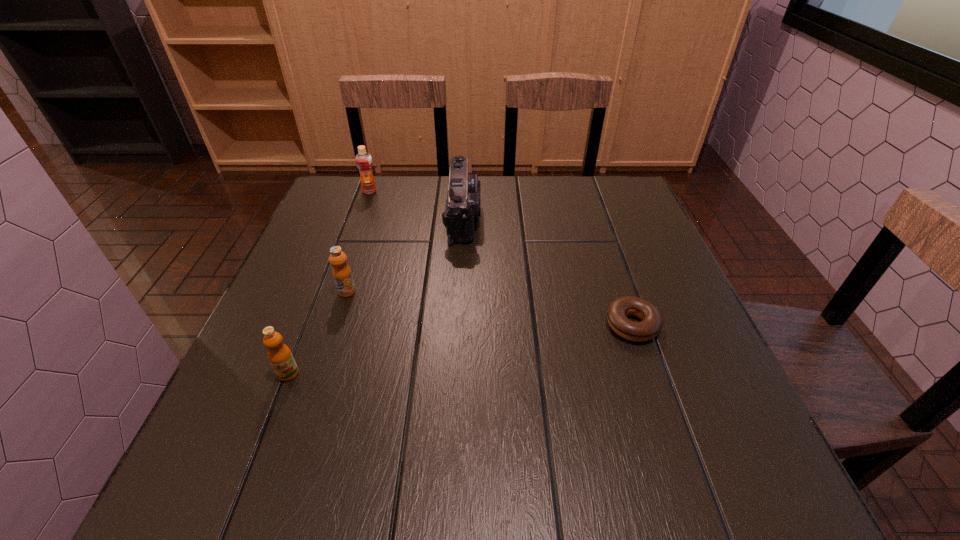
Where is `free point between the third nearest object and the nearest object`? free point between the third nearest object and the nearest object is located at coordinates (318, 333).

Identify which object is the third closest to the nearest object. Please provide its 2D coordinates. Your answer should be formatted as a tuple, i.e. [(x, y)], where the tuple contains the x and y coordinates of a point satisfying the conditions above.

[(618, 310)]

I want to click on object that is the third closest to the second farthest orange juice, so click(363, 159).

Image resolution: width=960 pixels, height=540 pixels. What are the coordinates of `the closest orange juice relative to the fourth object from left to right` in the screenshot? It's located at (363, 159).

Identify the location of orange juice that stands as the second closest to the nearest object. This screenshot has width=960, height=540. (363, 159).

This screenshot has height=540, width=960. Identify the location of vacant region that satisfies the following two spatial constraints: 1. on the front-facing side of the second object from right to left; 2. on the front label of the third farthest object. (460, 292).

At what (x,y) coordinates should I click in order to perform the action: click on vacant region that satisfies the following two spatial constraints: 1. on the front label of the shortest object; 2. on the left side of the second nearest orange juice. Please return your answer as a coordinate pair (x, y). The image size is (960, 540). Looking at the image, I should click on (336, 325).

This screenshot has width=960, height=540. I want to click on vacant space that satisfies the following two spatial constraints: 1. on the front-facing side of the rightmost object; 2. on the right side of the camcorder, so click(x=458, y=325).